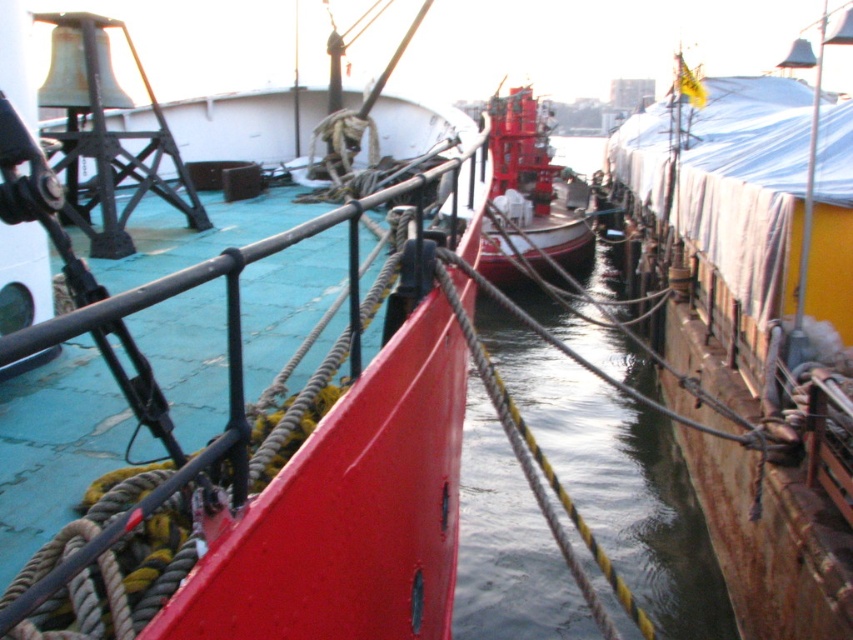
You are standing at the edge of the dock and see the point marked at coordinates (x=311, y=472). Which object does this point correspond to?

The point at coordinates (x=311, y=472) corresponds to the smooth red boat at center.

You are a dock worker who needs to board both the smooth red boat at center and the shiny red boat at center. Which boat will require you to climb a higher step to reach its deck?

The shiny red boat at center is taller than the smooth red boat at center, so you will need to climb higher steps to reach its deck.